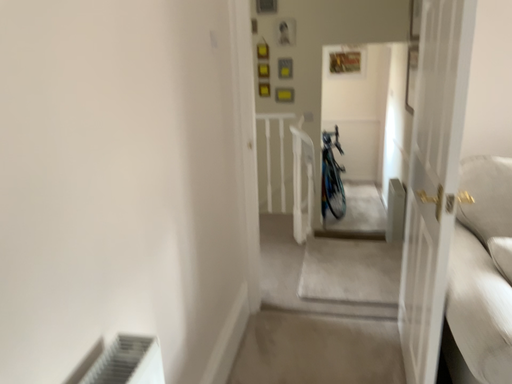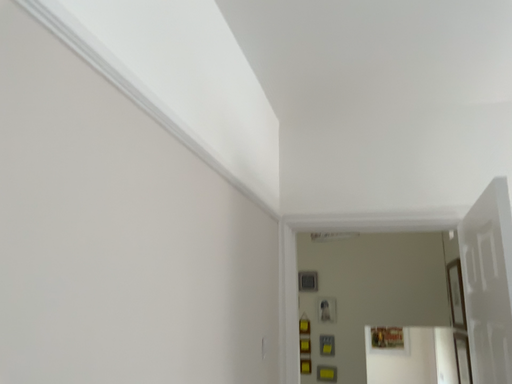
Question: How did the camera likely rotate when shooting the video?

Choices:
 (A) rotated downward
 (B) rotated upward

Answer: (B)